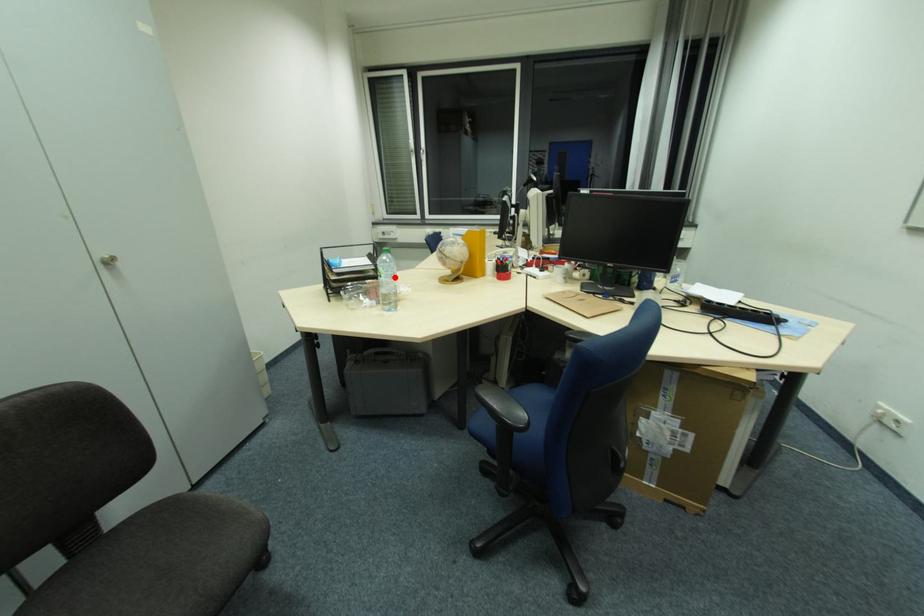
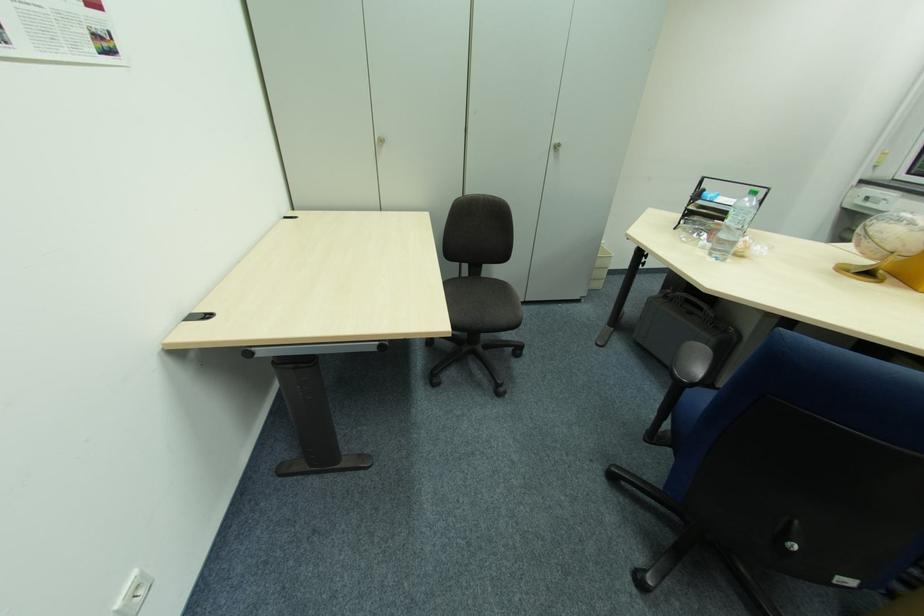
In the second image, find the point that corresponds to the highlighted location in the first image.

(743, 224)